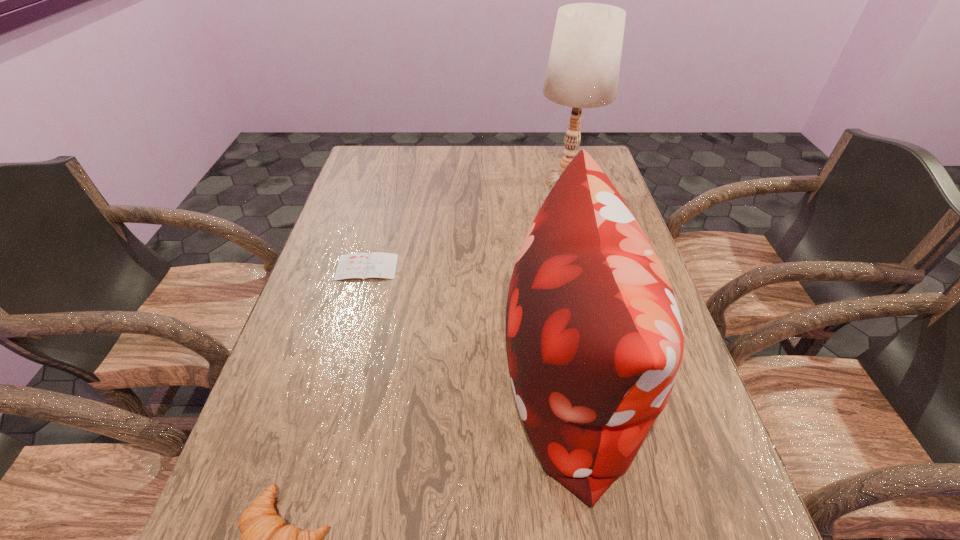
I want to click on object at the far edge, so click(x=583, y=69).

The width and height of the screenshot is (960, 540). Find the location of `object located in the left edge section of the desktop`. object located in the left edge section of the desktop is located at coordinates (377, 264).

Identify the location of lamp that is at the right edge. The height and width of the screenshot is (540, 960). (583, 69).

Image resolution: width=960 pixels, height=540 pixels. I want to click on cushion that is positioned at the right edge, so click(x=594, y=339).

Identify the location of object that is positioned at the far right corner. (583, 69).

This screenshot has width=960, height=540. Find the location of `vacant region at the far edge of the desktop`. vacant region at the far edge of the desktop is located at coordinates (420, 153).

Where is `free spot at the left edge of the desktop`? free spot at the left edge of the desktop is located at coordinates (234, 510).

Where is `vacant point at the far left corner`? vacant point at the far left corner is located at coordinates (387, 146).

Locate an element on the screen. Image resolution: width=960 pixels, height=540 pixels. free space between the lamp and the diary is located at coordinates (467, 224).

Identify the location of vacant area that lies between the third shortest object and the diary. (468, 327).